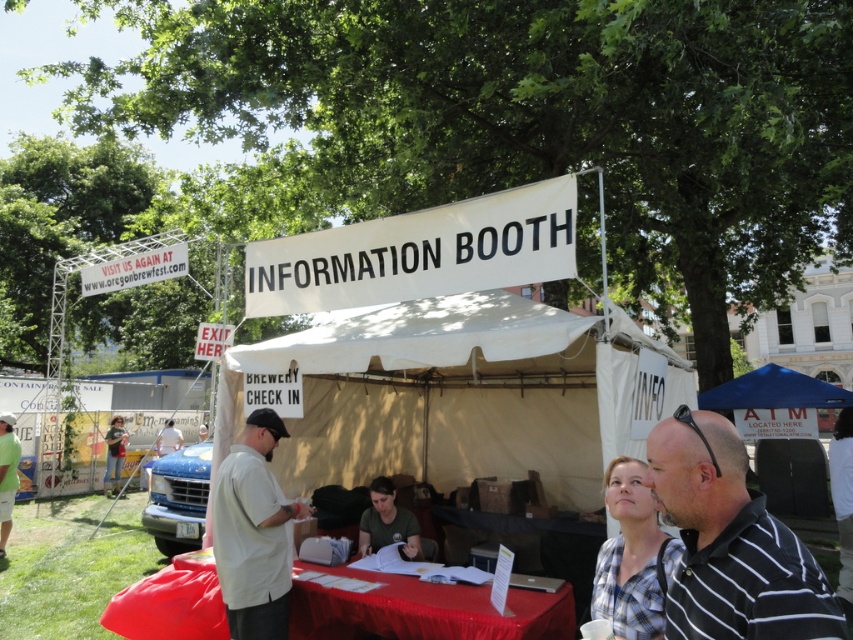
Between white cotton shirt at center and light green shirt at lower left, which one is positioned higher?

white cotton shirt at center

Does white cotton shirt at center appear over light green shirt at lower left?

Indeed, white cotton shirt at center is positioned over light green shirt at lower left.

Is point (276, 545) more distant than point (10, 444)?

That is False.

I want to click on white cotton shirt at center, so click(x=253, y=532).

Who is more forward, (795, 547) or (256, 592)?

Point (795, 547) is more forward.

Is point (703, 620) behind point (281, 522)?

No, it is in front of (281, 522).

Is point (715, 614) positioned before point (213, 513)?

Yes, point (715, 614) is closer to viewer.

Identify the location of black striped polo shirt at lower right. (730, 541).

In the scene shown: Is matte green shirt at center above light green shirt at lower left?

Correct, matte green shirt at center is located above light green shirt at lower left.

Consider the image. Can you confirm if matte green shirt at center is taller than light green shirt at lower left?

In fact, matte green shirt at center may be shorter than light green shirt at lower left.

Is point (387, 500) closer to viewer compared to point (9, 458)?

That is True.

The image size is (853, 640). I want to click on matte green shirt at center, so click(x=392, y=524).